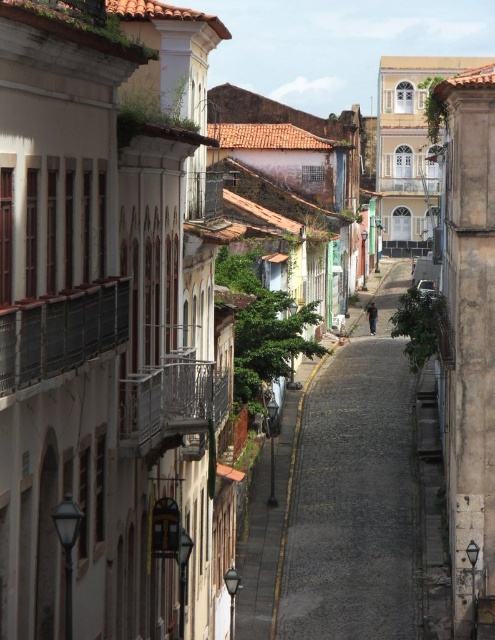
Question: Does cobblestone street at center appear on the left side of brown stone wall at right?

Choices:
 (A) yes
 (B) no

Answer: (A)

Question: Which point is farther from the camera taking this photo?

Choices:
 (A) (388, 413)
 (B) (489, 204)

Answer: (A)

Question: Which point is farther from the camera taking this photo?

Choices:
 (A) (288, 618)
 (B) (484, 540)

Answer: (A)

Question: Is cobblestone street at center wider than brown stone wall at right?

Choices:
 (A) yes
 (B) no

Answer: (A)

Question: Is cobblestone street at center in front of brown stone wall at right?

Choices:
 (A) yes
 (B) no

Answer: (B)